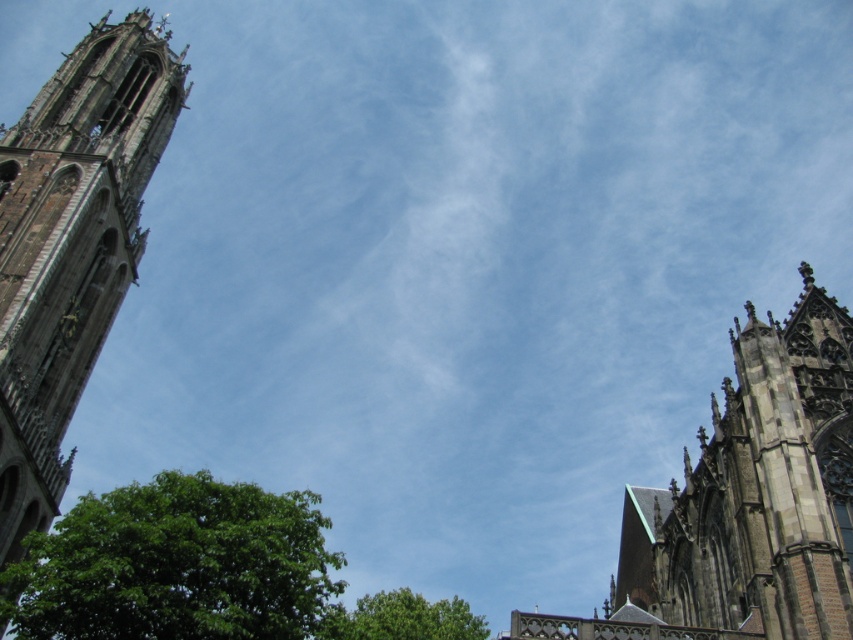
You are standing in front of the cathedral and want to take a photo that includes both the stone gothic tower at left and the green leafy tree at lower center. Which object should you position closer to the edge of your camera frame to ensure both are fully visible?

To ensure both the stone gothic tower at left and the green leafy tree at lower center are fully visible in your photo, position the green leafy tree at lower center closer to the edge of your camera frame since the stone gothic tower at left is already on its left side.

You are a visitor standing at the base of the cathedral and want to take a photo that includes both the brown stone tower at right and the green leafy tree at lower center. Which object will appear wider in the photo?

The green leafy tree at lower center will appear wider in the photo since it has a greater width compared to the brown stone tower at right.